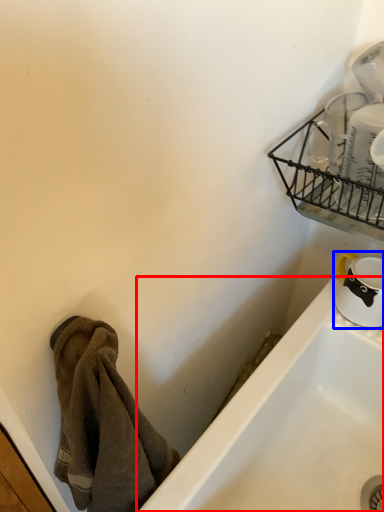
Question: Which point is closer to the camera, bathtub (highlighted by a red box) or tableware (highlighted by a blue box)?

Choices:
 (A) bathtub
 (B) tableware

Answer: (A)